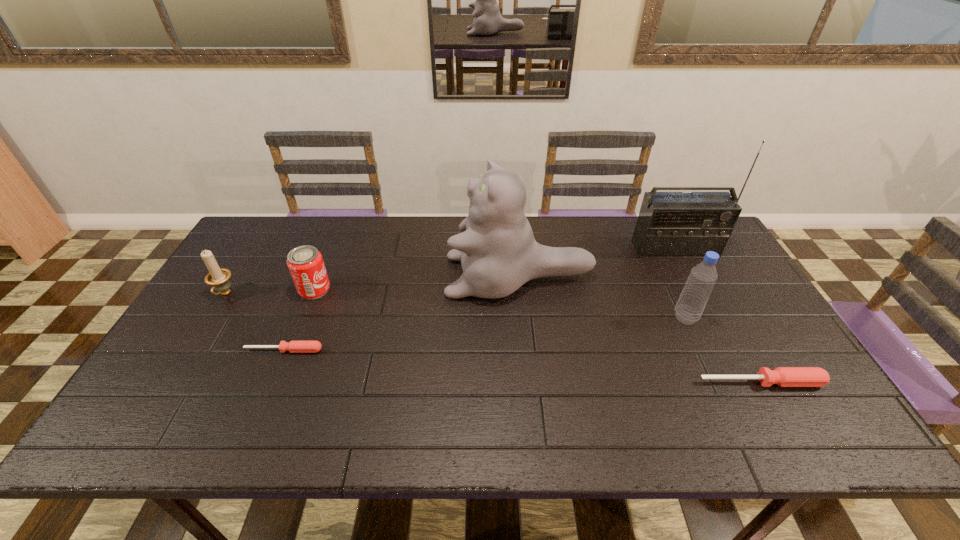
Please mark a free spot for a new screwdriver to balance the arrangement. Please provide its 2D coordinates. Your answer should be formatted as a tuple, i.e. [(x, y)], where the tuple contains the x and y coordinates of a point satisfying the conditions above.

[(515, 366)]